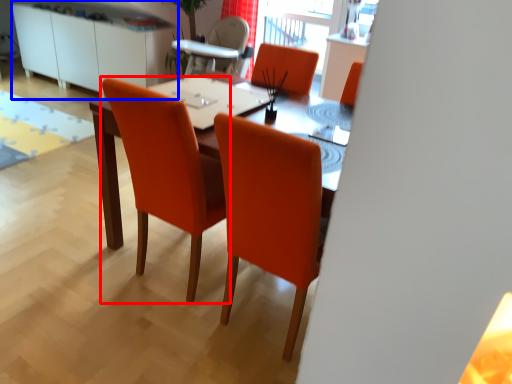
Question: Which point is closer to the camera, chair (highlighted by a red box) or dresser (highlighted by a blue box)?

Choices:
 (A) chair
 (B) dresser

Answer: (A)